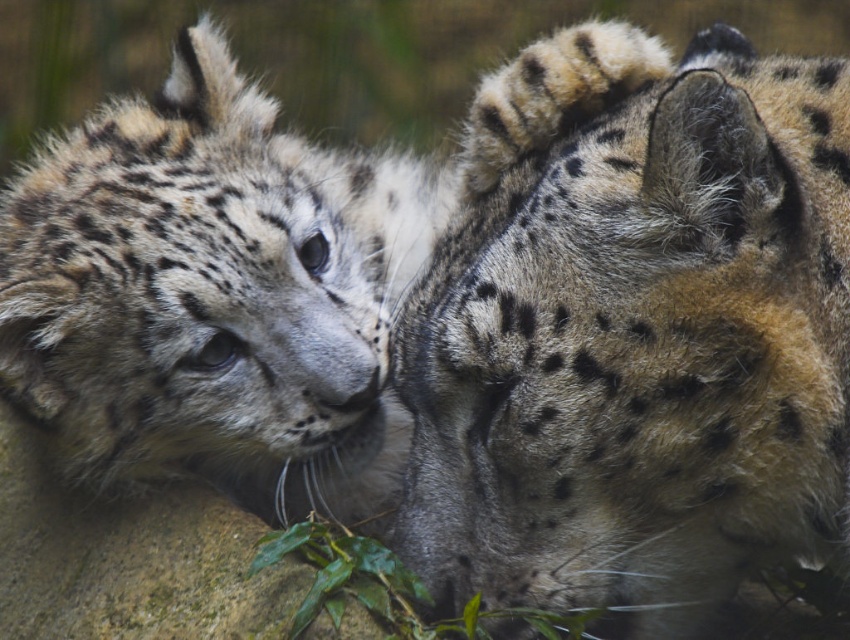
The height and width of the screenshot is (640, 850). Describe the element at coordinates (633, 333) in the screenshot. I see `spotted fur cheetah at center` at that location.

Does spotted fur cheetah at center appear on the right side of spotted fur snow leopard at left?

Indeed, spotted fur cheetah at center is positioned on the right side of spotted fur snow leopard at left.

What do you see at coordinates (633, 333) in the screenshot? Image resolution: width=850 pixels, height=640 pixels. I see `spotted fur cheetah at center` at bounding box center [633, 333].

Identify the location of spotted fur cheetah at center. (633, 333).